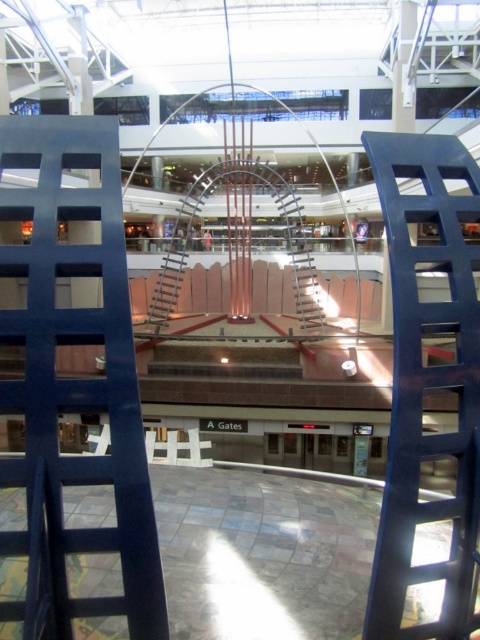
Question: Is polished stone floor at center in front of blue metallic ladder at center?

Choices:
 (A) no
 (B) yes

Answer: (A)

Question: Where is blue matte ladder at center located in relation to polished stone floor at center in the image?

Choices:
 (A) left
 (B) right

Answer: (A)

Question: Estimate the real-world distances between objects in this image. Which object is farther from the blue matte ladder at center?

Choices:
 (A) blue metallic ladder at center
 (B) polished stone floor at center

Answer: (B)

Question: Which point appears closest to the camera in this image?

Choices:
 (A) (451, 208)
 (B) (118, 173)
 (C) (216, 595)

Answer: (B)

Question: Based on their relative distances, which object is nearer to the blue metallic ladder at center?

Choices:
 (A) blue matte ladder at center
 (B) polished stone floor at center

Answer: (A)

Question: Is blue matte ladder at center behind blue metallic ladder at center?

Choices:
 (A) no
 (B) yes

Answer: (A)